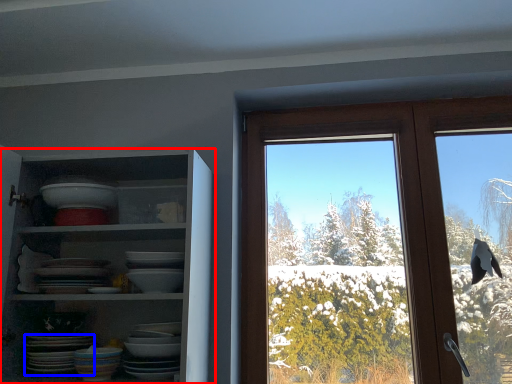
Question: Among these objects, which one is farthest to the camera, shelf (highlighted by a red box) or platter (highlighted by a blue box)?

Choices:
 (A) shelf
 (B) platter

Answer: (B)